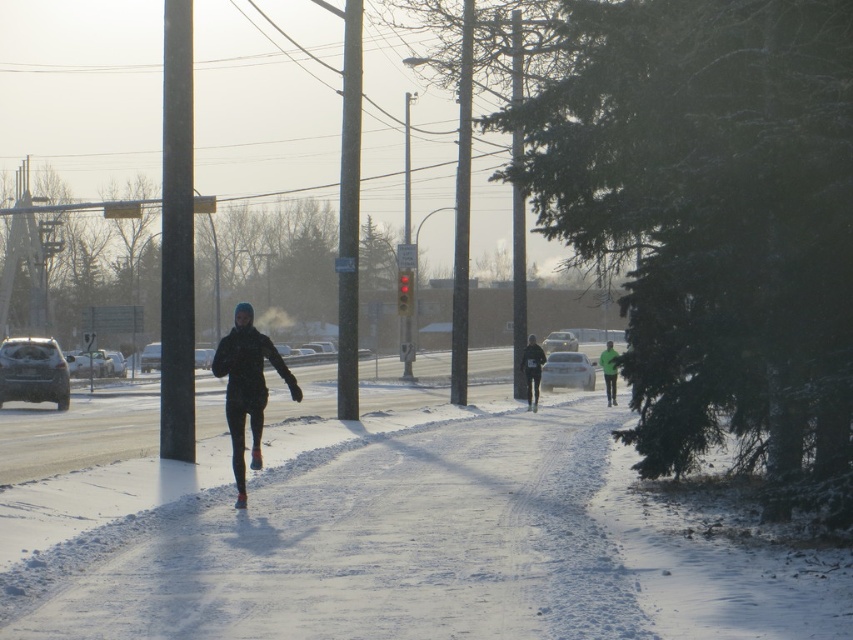
You are a photographer trying to capture the runner in the winter scene. You notice two jackets on the runner, a black matte jacket at center and a green matte jacket at center. Which jacket would you focus on if you want to emphasize a smaller size in your photo?

The black matte jacket at center is smaller than the green matte jacket at center, so focusing on the black matte jacket at center would emphasize a smaller size in the photo.

Consider the image. You are a photographer trying to decide which jacket to wear for a winter photoshoot. You see the black fabric jacket at center and the green matte jacket at center in the image. Based on their appearance, which jacket would you choose if you want a slimmer silhouette?

The black fabric jacket at center is thinner than the green matte jacket at center, so you should choose the black fabric jacket at center for a slimmer silhouette.

You are a photographer standing at the center of the sidewalk in the winter scene. You want to take a photo of the black fabric jacket at center. Where should you aim your camera to capture it in the frame?

To capture the black fabric jacket at center, aim your camera at the 2D location point at coordinates [532,371].